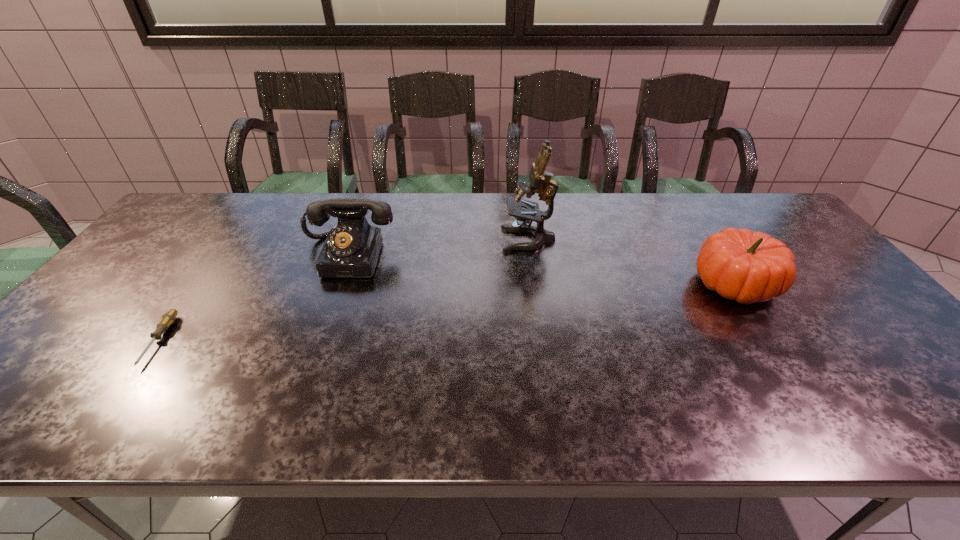
Identify the location of object that stands as the second closest to the pumpkin. The width and height of the screenshot is (960, 540). (351, 250).

Locate an element on the screen. free space that satisfies the following two spatial constraints: 1. at the eyepieces of the second object from right to left; 2. on the dial of the telephone is located at coordinates (531, 256).

The width and height of the screenshot is (960, 540). Identify the location of vacant area that satisfies the following two spatial constraints: 1. at the eyepieces of the tallest object; 2. at the tip of the shortest object. (542, 341).

Identify the location of vacant space that satisfies the following two spatial constraints: 1. at the eyepieces of the microscope; 2. at the tip of the shortest object. tap(542, 341).

At what (x,y) coordinates should I click in order to perform the action: click on free spot that satisfies the following two spatial constraints: 1. on the back side of the pumpkin; 2. at the eyepieces of the tallest object. Please return your answer as a coordinate pair (x, y). This screenshot has height=540, width=960. Looking at the image, I should click on [706, 240].

Find the location of a particular element. This screenshot has height=540, width=960. free spot that satisfies the following two spatial constraints: 1. at the eyepieces of the tallest object; 2. on the right side of the rightmost object is located at coordinates (535, 284).